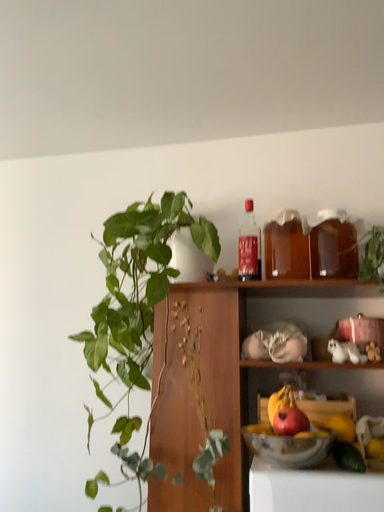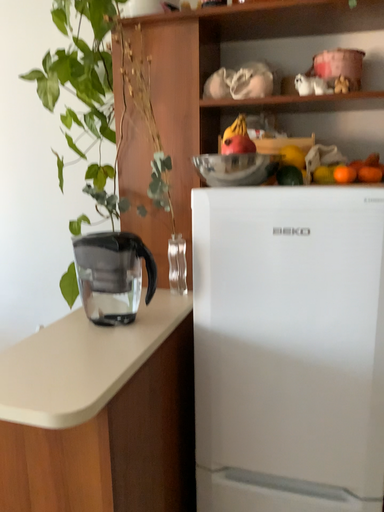
Question: Which way did the camera rotate in the video?

Choices:
 (A) rotated downward
 (B) rotated upward

Answer: (A)